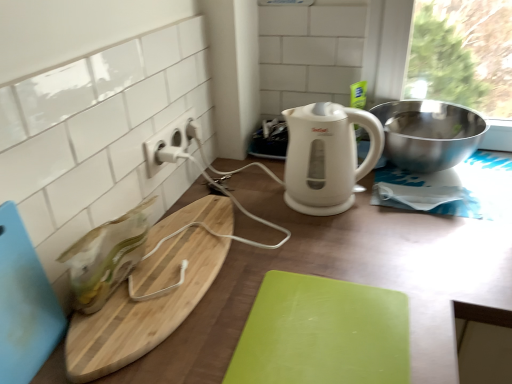
I want to click on blank space above wooden cutting board at center (from a real-world perspective), so click(x=383, y=204).